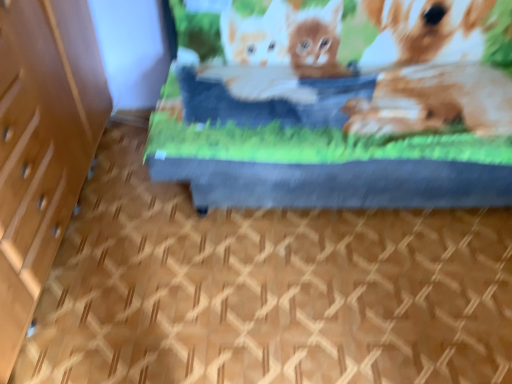
Question: Is blue fabric bed at center wider or thinner than wooden file cabinet at left?

Choices:
 (A) wide
 (B) thin

Answer: (A)

Question: From the image's perspective, relative to wooden file cabinet at left, is blue fabric bed at center above or below?

Choices:
 (A) above
 (B) below

Answer: (A)

Question: From a real-world perspective, is blue fabric bed at center positioned above or below wooden file cabinet at left?

Choices:
 (A) above
 (B) below

Answer: (B)

Question: Is wooden file cabinet at left wider or thinner than blue fabric bed at center?

Choices:
 (A) wide
 (B) thin

Answer: (B)

Question: Is wooden file cabinet at left inside or outside of blue fabric bed at center?

Choices:
 (A) outside
 (B) inside

Answer: (A)

Question: Considering the positions of wooden file cabinet at left and blue fabric bed at center in the image, is wooden file cabinet at left bigger or smaller than blue fabric bed at center?

Choices:
 (A) big
 (B) small

Answer: (B)

Question: From a real-world perspective, is wooden file cabinet at left above or below blue fabric bed at center?

Choices:
 (A) above
 (B) below

Answer: (A)